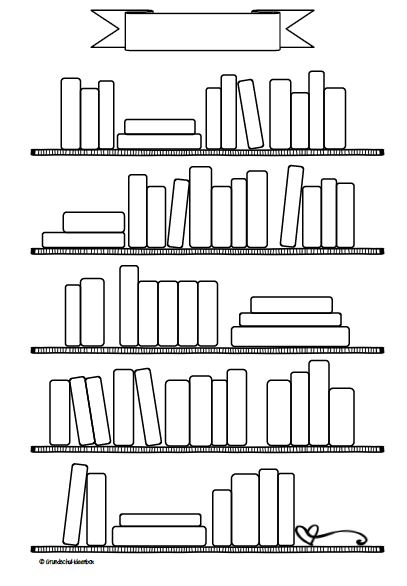
Where is `books on the bottom shelf`? Image resolution: width=407 pixels, height=586 pixels. books on the bottom shelf is located at coordinates (72, 520), (100, 527), (138, 519), (145, 536), (222, 520), (243, 519), (267, 517), (284, 515).